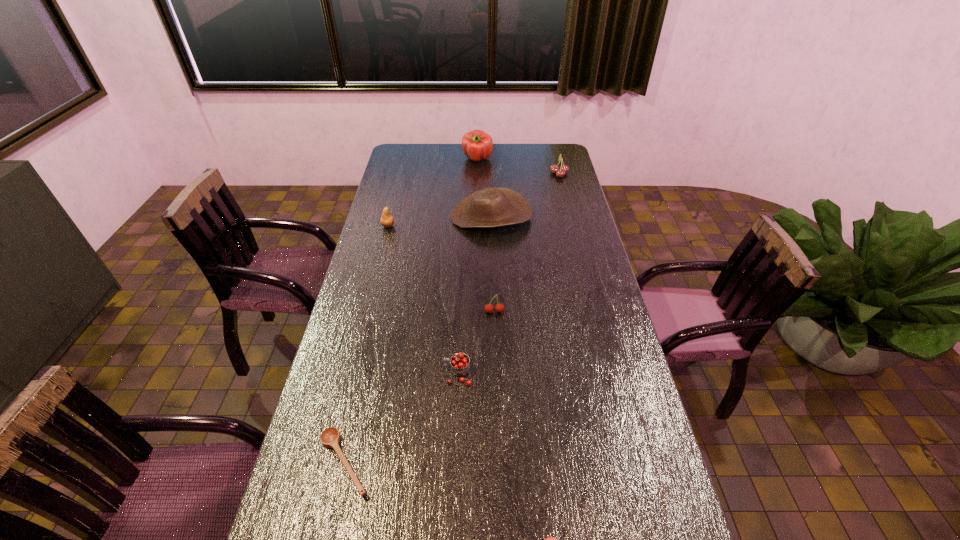
The image size is (960, 540). In order to click on free space at the far left corner in this screenshot , I will do `click(420, 146)`.

Find the location of a particular element. The image size is (960, 540). vacant space at the far right corner of the desktop is located at coordinates (562, 159).

You are a GUI agent. You are given a task and a screenshot of the screen. Output one action in this format:
    pyautogui.click(x=<x>, y=<y>)
    Task: Click on the free spot between the seventh farthest object and the cowboy hat
    This screenshot has height=540, width=960.
    Given the screenshot: What is the action you would take?
    tap(418, 340)

I want to click on empty space that is in between the leftmost cherry and the shortest object, so [401, 418].

What are the coordinates of `free space between the seventh nearest object and the bell pepper` in the screenshot? It's located at tap(518, 166).

This screenshot has width=960, height=540. I want to click on unoccupied position between the third nearest object and the rightmost object, so click(508, 274).

Locate an element on the screen. The image size is (960, 540). free space between the cowboy hat and the seventh nearest object is located at coordinates (525, 195).

Identify which object is the second nearest to the pear. Please provide its 2D coordinates. Your answer should be formatted as a tuple, i.e. [(x, y)], where the tuple contains the x and y coordinates of a point satisfying the conditions above.

[(477, 145)]

At what (x,y) coordinates should I click in order to perform the action: click on object that is the second closest one to the pear. Please return your answer as a coordinate pair (x, y). This screenshot has width=960, height=540. Looking at the image, I should click on (477, 145).

Point out which cherry is positioned as the third nearest to the pear. Please provide its 2D coordinates. Your answer should be formatted as a tuple, i.e. [(x, y)], where the tuple contains the x and y coordinates of a point satisfying the conditions above.

[(560, 173)]